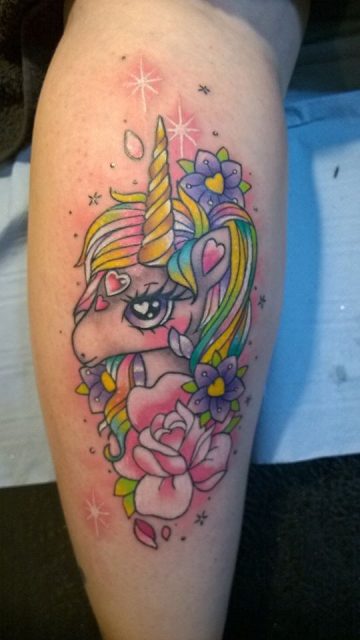
Where is `floor`? floor is located at coordinates click(287, 543).